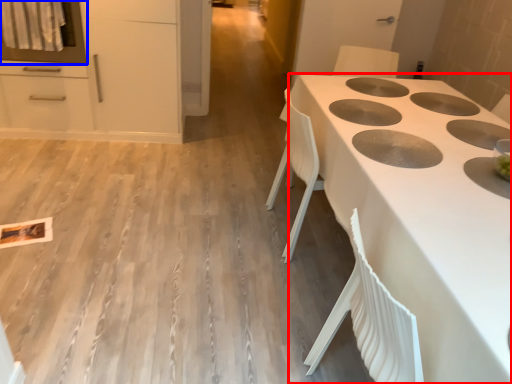
Question: Which point is closer to the camera, countertop (highlighted by a red box) or oven (highlighted by a blue box)?

Choices:
 (A) countertop
 (B) oven

Answer: (A)